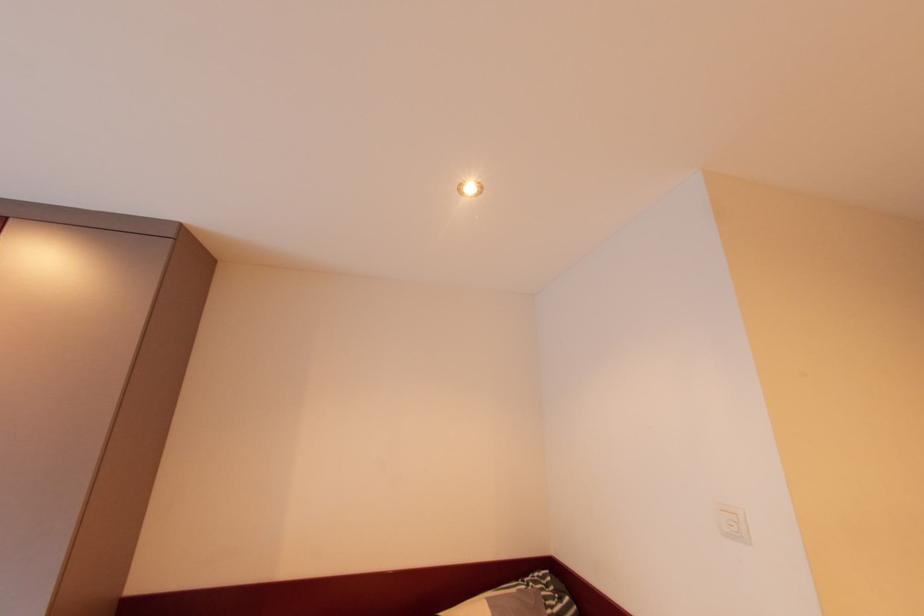
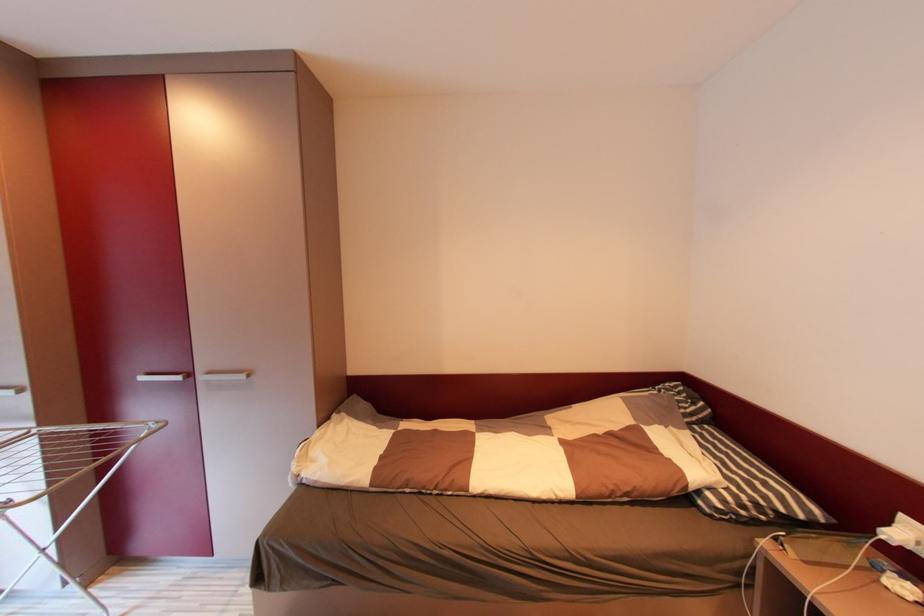
Question: In a continuous first-person perspective shot, in which direction is the camera moving?

Choices:
 (A) Left
 (B) Right
 (C) Forward
 (D) Backward

Answer: (A)